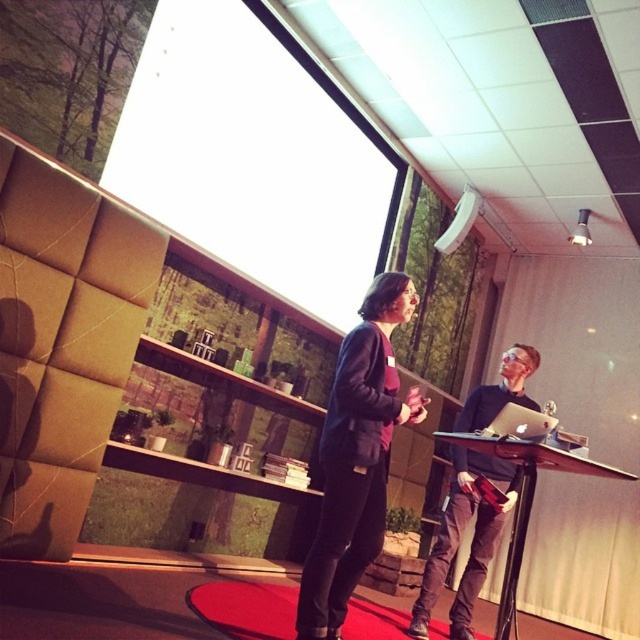
Question: Considering the real-world distances, which object is closest to the matte black laptop at right?

Choices:
 (A) matte black jacket at center
 (B) white glossy projection screen at upper center
 (C) black glossy table at center

Answer: (C)

Question: Which point is farther from the camera taking this photo?

Choices:
 (A) (369, 536)
 (B) (429, 573)

Answer: (B)

Question: Is the position of matte black laptop at right more distant than that of black glossy table at center?

Choices:
 (A) no
 (B) yes

Answer: (B)

Question: Observing the image, what is the correct spatial positioning of matte black jacket at center in reference to black glossy table at center?

Choices:
 (A) below
 (B) above

Answer: (B)

Question: Can you confirm if white glossy projection screen at upper center is bigger than black glossy table at center?

Choices:
 (A) yes
 (B) no

Answer: (A)

Question: Which point is closer to the camera?

Choices:
 (A) matte black laptop at right
 (B) white glossy projection screen at upper center

Answer: (A)